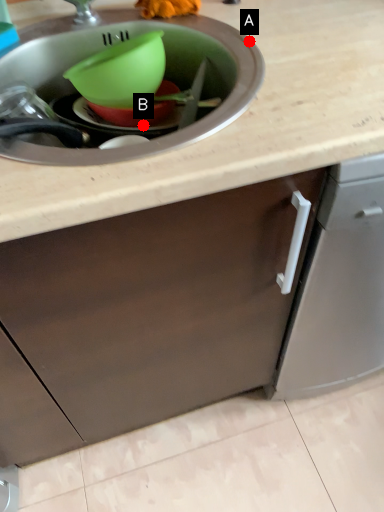
Question: Two points are circled on the image, labeled by A and B beside each circle. Which of the following is the farthest from the observer?

Choices:
 (A) A is further
 (B) B is further

Answer: (B)